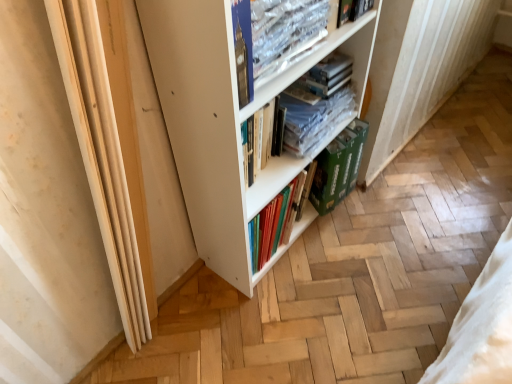
The width and height of the screenshot is (512, 384). Identify the location of clear plastic book at upper center, which is the 1th book in front-to-back order. [285, 32].

What is the approximate width of clear plastic book at upper center, which is the 1th book in front-to-back order?

clear plastic book at upper center, which is the 1th book in front-to-back order, is 1.76 inches in width.

Measure the distance between point (218, 147) and camera.

37.36 inches.

What do you see at coordinates (225, 120) in the screenshot?
I see `white matte bookcase at center` at bounding box center [225, 120].

Find the location of a particular element. clear plastic book at upper center, acting as the 3th book starting from the back is located at coordinates (285, 32).

Considering the positions of points (358, 2) and (266, 106), is point (358, 2) farther from camera compared to point (266, 106)?

Yes, it is.

From a real-world perspective, which is physically above, hardcover book at upper center, positioned as the 2th book in back-to-front order, or clear plastic books at center, the 3th book from the front?

hardcover book at upper center, positioned as the 2th book in back-to-front order, is physically above.

Can you confirm if hardcover book at upper center, positioned as the 2th book in back-to-front order, is positioned to the left of clear plastic books at center, the 3th book from the front?

No, hardcover book at upper center, positioned as the 2th book in back-to-front order, is not to the left of clear plastic books at center, the 3th book from the front.

Is hardcover book at upper center, marked as the 2th book in a front-to-back arrangement, inside or outside of clear plastic books at center, acting as the first book starting from the back?

hardcover book at upper center, marked as the 2th book in a front-to-back arrangement, is spatially situated outside clear plastic books at center, acting as the first book starting from the back.

Is clear plastic books at center, acting as the first book starting from the back, turned away from white matte bookcase at center?

Yes.

Can you confirm if clear plastic books at center, acting as the first book starting from the back, is taller than white matte bookcase at center?

No.

Is white matte bookcase at center a part of clear plastic books at center, acting as the first book starting from the back?

No, white matte bookcase at center is not a part of clear plastic books at center, acting as the first book starting from the back.

Considering the relative sizes of clear plastic books at center, the 3th book from the front, and white matte bookcase at center in the image provided, is clear plastic books at center, the 3th book from the front, thinner than white matte bookcase at center?

Correct, the width of clear plastic books at center, the 3th book from the front, is less than that of white matte bookcase at center.

From the image's perspective, is clear plastic books at center, acting as the first book starting from the back, located above or below clear plastic book at upper center, which is the 1th book in front-to-back order?

clear plastic books at center, acting as the first book starting from the back, is below clear plastic book at upper center, which is the 1th book in front-to-back order.

Which is correct: clear plastic books at center, acting as the first book starting from the back, is inside clear plastic book at upper center, which is the 1th book in front-to-back order, or outside of it?

clear plastic books at center, acting as the first book starting from the back, is not inside clear plastic book at upper center, which is the 1th book in front-to-back order, it's outside.

Is clear plastic books at center, the 3th book from the front, aimed at clear plastic book at upper center, which is the 1th book in front-to-back order?

No, clear plastic books at center, the 3th book from the front, is not oriented towards clear plastic book at upper center, which is the 1th book in front-to-back order.

From a real-world perspective, is green cardboard box at lower center positioned under clear plastic book at upper center, which is the 1th book in front-to-back order, based on gravity?

Yes, from a real-world perspective, green cardboard box at lower center is below clear plastic book at upper center, which is the 1th book in front-to-back order.

From the image's perspective, is green cardboard box at lower center beneath clear plastic book at upper center, which is the 1th book in front-to-back order?

Indeed, from the image's perspective, green cardboard box at lower center is shown beneath clear plastic book at upper center, which is the 1th book in front-to-back order.

Is green cardboard box at lower center oriented away from clear plastic book at upper center, which is the 1th book in front-to-back order?

green cardboard box at lower center is not turned away from clear plastic book at upper center, which is the 1th book in front-to-back order.

Which of these two, green cardboard box at lower center or clear plastic book at upper center, acting as the 3th book starting from the back, stands shorter?

Standing shorter between the two is clear plastic book at upper center, acting as the 3th book starting from the back.

Between green cardboard box at lower center and clear plastic books at center, acting as the first book starting from the back, which one has less height?

With less height is clear plastic books at center, acting as the first book starting from the back.

From a real-world perspective, relative to clear plastic books at center, acting as the first book starting from the back, is green cardboard box at lower center vertically above or below?

green cardboard box at lower center is situated lower than clear plastic books at center, acting as the first book starting from the back, in the real world.

From a real-world perspective, starting from the green cardboard box at lower center, which book is the 1st one vertically above it? Please provide its 2D coordinates.

[(310, 108)]

From the picture: Is green cardboard box at lower center wider or thinner than clear plastic books at center, the 3th book from the front?

In the image, green cardboard box at lower center appears to be more narrow than clear plastic books at center, the 3th book from the front.

From a real-world perspective, relative to clear plastic book at upper center, which is the 1th book in front-to-back order, is hardcover book at upper center, marked as the 2th book in a front-to-back arrangement, vertically above or below?

hardcover book at upper center, marked as the 2th book in a front-to-back arrangement, is above clear plastic book at upper center, which is the 1th book in front-to-back order.

From the image's perspective, between hardcover book at upper center, marked as the 2th book in a front-to-back arrangement, and clear plastic book at upper center, which is the 1th book in front-to-back order, which one is located above?

hardcover book at upper center, marked as the 2th book in a front-to-back arrangement, from the image's perspective.

How different are the orientations of hardcover book at upper center, positioned as the 2th book in back-to-front order, and clear plastic book at upper center, acting as the 3th book starting from the back, in degrees?

The angular difference between hardcover book at upper center, positioned as the 2th book in back-to-front order, and clear plastic book at upper center, acting as the 3th book starting from the back, is 7.77 degrees.

In terms of size, does hardcover book at upper center, marked as the 2th book in a front-to-back arrangement, appear bigger or smaller than clear plastic book at upper center, acting as the 3th book starting from the back?

hardcover book at upper center, marked as the 2th book in a front-to-back arrangement, is bigger than clear plastic book at upper center, acting as the 3th book starting from the back.

From the image's perspective, which object appears higher, clear plastic book at upper center, which is the 1th book in front-to-back order, or clear plastic books at center, acting as the first book starting from the back?

clear plastic book at upper center, which is the 1th book in front-to-back order, is shown above in the image.

Is clear plastic book at upper center, which is the 1th book in front-to-back order, beside clear plastic books at center, acting as the first book starting from the back?

No, clear plastic book at upper center, which is the 1th book in front-to-back order, is not beside clear plastic books at center, acting as the first book starting from the back.

Considering the sizes of objects clear plastic book at upper center, which is the 1th book in front-to-back order, and clear plastic books at center, the 3th book from the front, in the image provided, who is bigger, clear plastic book at upper center, which is the 1th book in front-to-back order, or clear plastic books at center, the 3th book from the front,?

Bigger between the two is clear plastic books at center, the 3th book from the front.

Which is in front, point (269, 8) or point (255, 127)?

The point (269, 8) is closer to the camera.

This screenshot has width=512, height=384. I want to click on book that is the 1st one when counting forward from the clear plastic books at center, acting as the first book starting from the back, so click(352, 10).

From the white matte bookcase at center, count 2nd book to the right and point to it. Please provide its 2D coordinates.

[(310, 108)]

From the image, which object appears to be farther from green cardboard box at lower center, clear plastic books at center, the 3th book from the front, or clear plastic book at upper center, acting as the 3th book starting from the back?

clear plastic book at upper center, acting as the 3th book starting from the back, is further to green cardboard box at lower center.

Based on their spatial positions, is clear plastic books at center, acting as the first book starting from the back, or green cardboard box at lower center closer to white matte bookcase at center?

Based on the image, clear plastic books at center, acting as the first book starting from the back, appears to be nearer to white matte bookcase at center.

Looking at the image, which one is located further to green cardboard box at lower center, clear plastic book at upper center, acting as the 3th book starting from the back, or hardcover book at upper center, marked as the 2th book in a front-to-back arrangement?

Among the two, clear plastic book at upper center, acting as the 3th book starting from the back, is located further to green cardboard box at lower center.

When comparing their distances from clear plastic book at upper center, which is the 1th book in front-to-back order, does green cardboard box at lower center or white matte bookcase at center seem further?

green cardboard box at lower center.

Estimate the real-world distances between objects in this image. Which object is closer to hardcover book at upper center, positioned as the 2th book in back-to-front order, green cardboard box at lower center or clear plastic books at center, the 3th book from the front?

clear plastic books at center, the 3th book from the front, is closer to hardcover book at upper center, positioned as the 2th book in back-to-front order.

From the image, which object appears to be nearer to green cardboard box at lower center, clear plastic books at center, the 3th book from the front, or white matte bookcase at center?

clear plastic books at center, the 3th book from the front, is positioned closer to the anchor green cardboard box at lower center.

Based on their spatial positions, is white matte bookcase at center or hardcover book at upper center, marked as the 2th book in a front-to-back arrangement, closer to clear plastic books at center, the 3th book from the front?

white matte bookcase at center is closer to clear plastic books at center, the 3th book from the front.

Which object lies further to the anchor point clear plastic books at center, the 3th book from the front, green cardboard box at lower center or clear plastic book at upper center, acting as the 3th book starting from the back?

clear plastic book at upper center, acting as the 3th book starting from the back.

The height and width of the screenshot is (384, 512). I want to click on book between clear plastic book at upper center, which is the 1th book in front-to-back order, and clear plastic books at center, acting as the first book starting from the back, along the z-axis, so click(x=352, y=10).